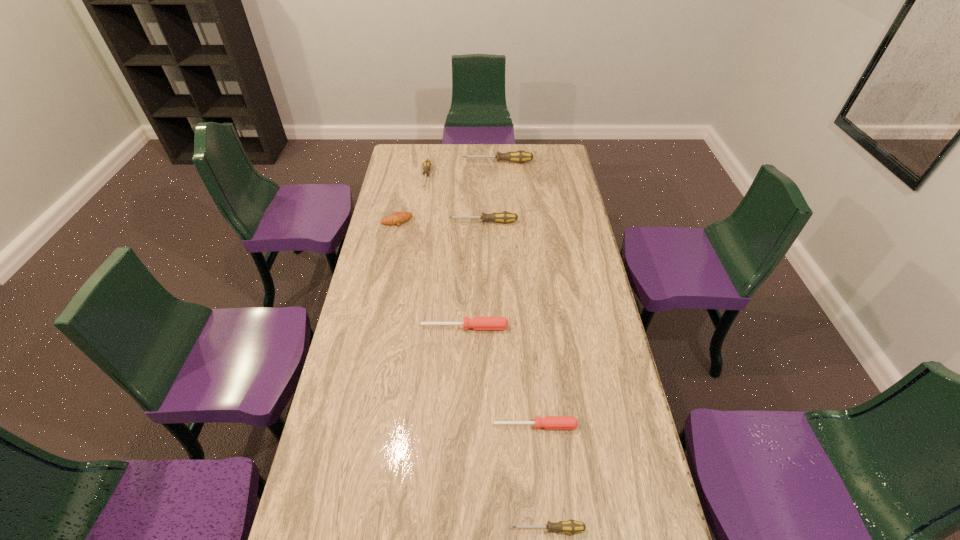
Locate which screwdriver is the fifth closest to the second smallest gray screwdriver. Please provide its 2D coordinates. Your answer should be formatted as a tuple, i.e. [(x, y)], where the tuple contains the x and y coordinates of a point satisfying the conditions above.

[(571, 526)]

Point out which screwdriver is positioned as the fifth nearest to the nearest object. Please provide its 2D coordinates. Your answer should be formatted as a tuple, i.e. [(x, y)], where the tuple contains the x and y coordinates of a point satisfying the conditions above.

[(519, 156)]

This screenshot has height=540, width=960. I want to click on gray screwdriver that is the closest to the tallest object, so [427, 163].

Find the location of a particular element. This screenshot has width=960, height=540. gray screwdriver that is the third closest one to the leftmost object is located at coordinates (519, 156).

Identify the location of the closest red screwdriver to the second smallest gray screwdriver. (477, 323).

Where is `the second closest red screwdriver to the tallest screwdriver`? The image size is (960, 540). the second closest red screwdriver to the tallest screwdriver is located at coordinates (548, 422).

You are a GUI agent. You are given a task and a screenshot of the screen. Output one action in this format:
    pyautogui.click(x=<x>, y=<y>)
    Task: Click on the free space that satisfies the following two spatial constraints: 1. at the tip of the tallest object; 2. on the front side of the leftmost object
    This screenshot has width=960, height=540.
    Given the screenshot: What is the action you would take?
    pyautogui.click(x=501, y=221)

Locate an element on the screen. The height and width of the screenshot is (540, 960). vacant space that satisfies the following two spatial constraints: 1. at the tip of the second nearest screwdriver; 2. on the right side of the third farthest screwdriver is located at coordinates (485, 426).

Image resolution: width=960 pixels, height=540 pixels. In order to click on free spot that satisfies the following two spatial constraints: 1. at the tip of the smaller red screwdriver; 2. on the right side of the biggest gray screwdriver in this screenshot , I will do `click(512, 426)`.

You are a GUI agent. You are given a task and a screenshot of the screen. Output one action in this format:
    pyautogui.click(x=<x>, y=<y>)
    Task: Click on the vacant space that satisfies the following two spatial constraints: 1. on the back side of the sixth farthest object; 2. at the tip of the second nearest gray screwdriver
    The height and width of the screenshot is (540, 960).
    Given the screenshot: What is the action you would take?
    pyautogui.click(x=517, y=222)